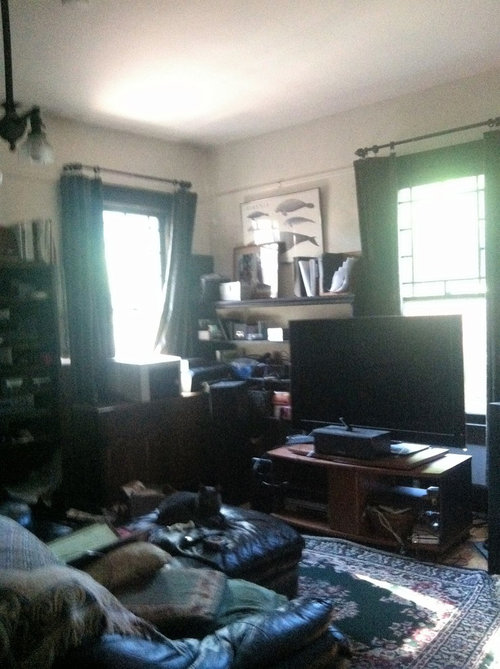
At what (x,y) coordinates should I click in order to perform the action: click on windows. Please return your answer as a coordinate pair (x, y). Image resolution: width=500 pixels, height=669 pixels. Looking at the image, I should click on (450, 259), (128, 264).